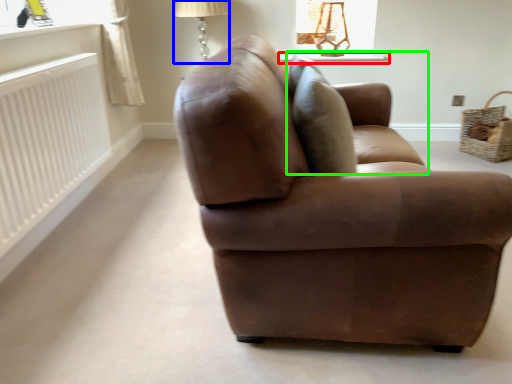
Question: Based on their relative distances, which object is farther from window sill (highlighted by a red box)? Choose from table lamp (highlighted by a blue box) and swivel chair (highlighted by a green box).

Choices:
 (A) table lamp
 (B) swivel chair

Answer: (B)